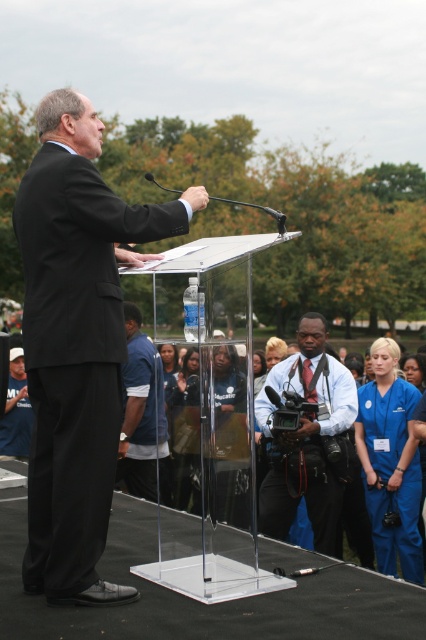
Can you confirm if matte black suit at center is positioned above blue shirt at center?

Indeed, matte black suit at center is positioned over blue shirt at center.

Is matte black suit at center wider than blue shirt at center?

Yes.

This screenshot has width=426, height=640. Identify the location of matte black suit at center. (77, 342).

Image resolution: width=426 pixels, height=640 pixels. What are the coordinates of `matte black suit at center` in the screenshot? It's located at (77, 342).

Between blue shirt at center and blue fabric shirt at center, which one has more height?

Standing taller between the two is blue shirt at center.

Is blue shirt at center shorter than blue fabric shirt at center?

Incorrect, blue shirt at center's height does not fall short of blue fabric shirt at center's.

Is point (330, 406) in front of point (141, 392)?

Yes, it is.

Where is `blue shirt at center`? This screenshot has width=426, height=640. blue shirt at center is located at coordinates (305, 440).

Does blue shirt at center appear on the right side of blue scrubs at right?

In fact, blue shirt at center is to the left of blue scrubs at right.

Who is taller, blue shirt at center or blue scrubs at right?

Standing taller between the two is blue shirt at center.

This screenshot has width=426, height=640. Describe the element at coordinates (305, 440) in the screenshot. I see `blue shirt at center` at that location.

I want to click on blue shirt at center, so click(x=305, y=440).